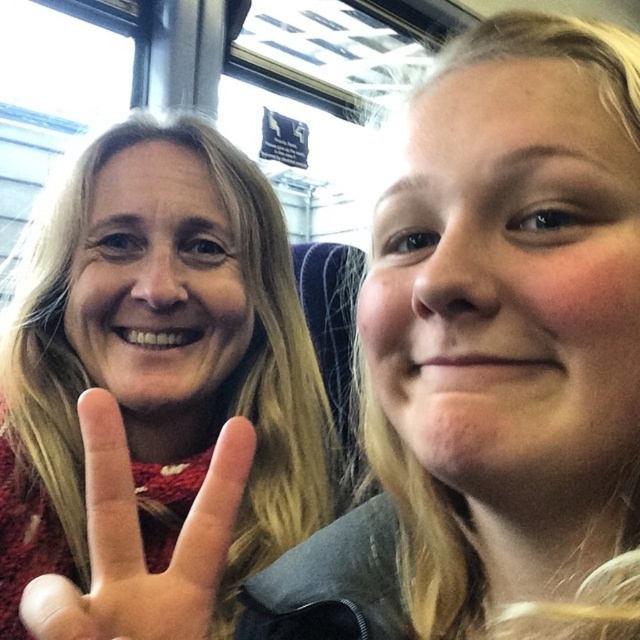
Who is more forward, (x=216, y=560) or (x=209, y=579)?

Positioned in front is point (x=209, y=579).

Is point (68, 470) closer to viewer compared to point (221, 508)?

That is False.

Between point (3, 540) and point (125, 573), which one is positioned behind?

Point (3, 540)

Find the location of a particular element. The image size is (640, 640). matte red sweater at left is located at coordinates (157, 381).